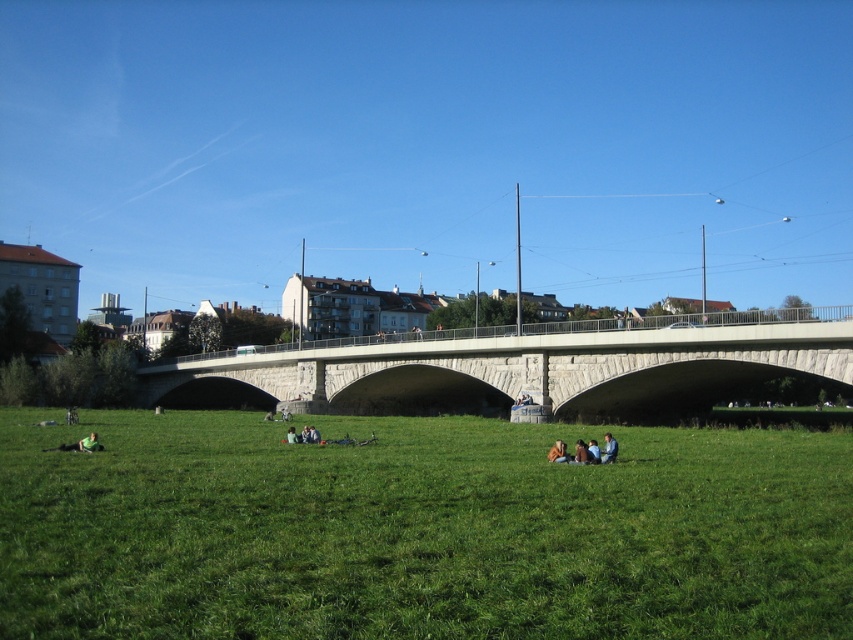
Who is lower down, green grassy field at lower center or green fabric jacket at lower center?

Positioned lower is green grassy field at lower center.

Does point (291, 625) come behind point (590, 451)?

No, it is not.

Where is `green grassy field at lower center`? The image size is (853, 640). green grassy field at lower center is located at coordinates (418, 531).

Find the location of a particular element. green grassy field at lower center is located at coordinates (418, 531).

From the picture: Between stone bridge at center and blue denim jeans at lower center, which one has more height?

Standing taller between the two is stone bridge at center.

Identify the location of stone bridge at center. The image size is (853, 640). (514, 369).

Between stone bridge at center and green fabric jacket at lower center, which one has more height?

stone bridge at center

Consider the image. Is stone bridge at center further to camera compared to green fabric jacket at lower center?

Yes, stone bridge at center is further from the viewer.

This screenshot has width=853, height=640. Describe the element at coordinates (514, 369) in the screenshot. I see `stone bridge at center` at that location.

Locate an element on the screen. stone bridge at center is located at coordinates (514, 369).